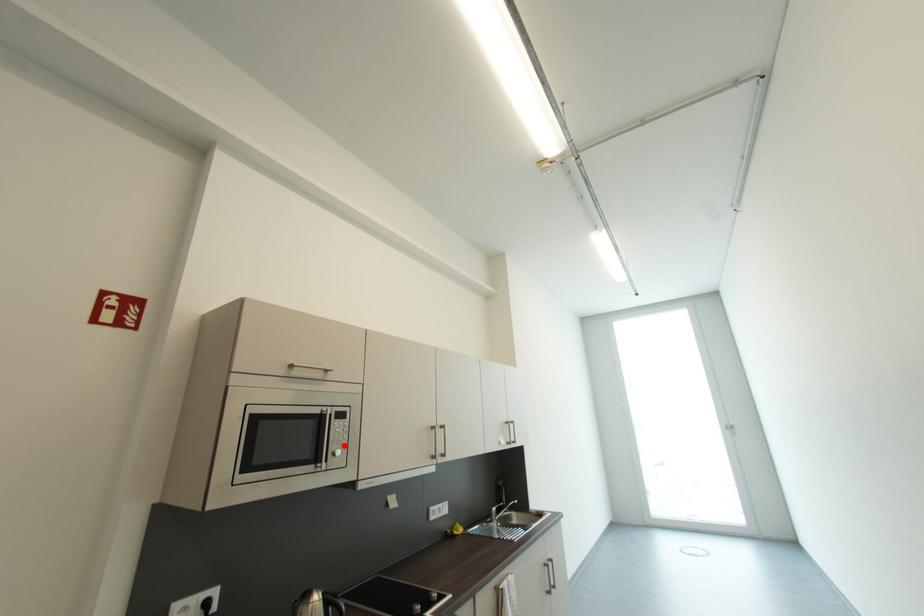
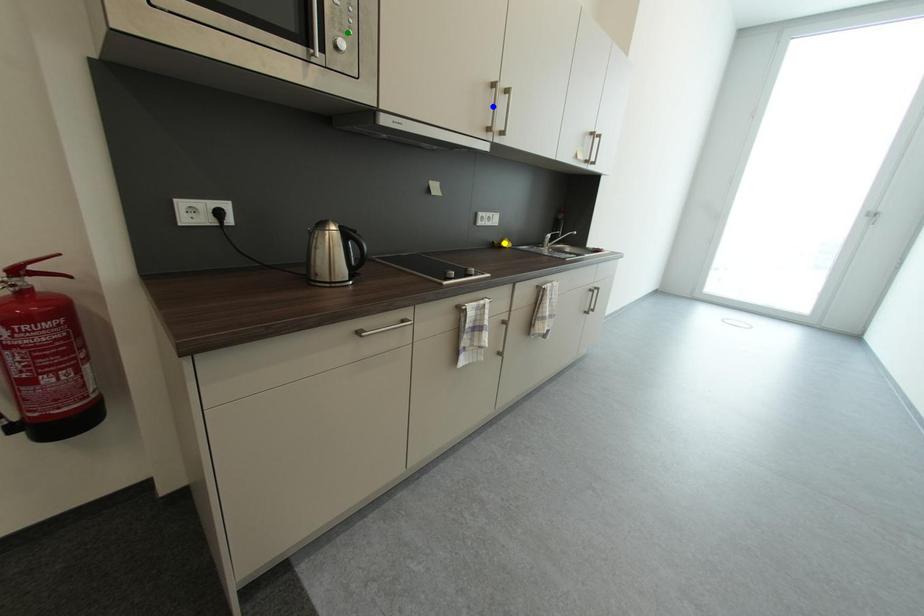
Question: I am providing you with two images of the same scene from different viewpoints. A red point is marked on the first image. You are given multiple points on the second image. Which mark in image 2 goes with the point in image 1?

Choices:
 (A) blue point
 (B) yellow point
 (C) green point

Answer: (C)